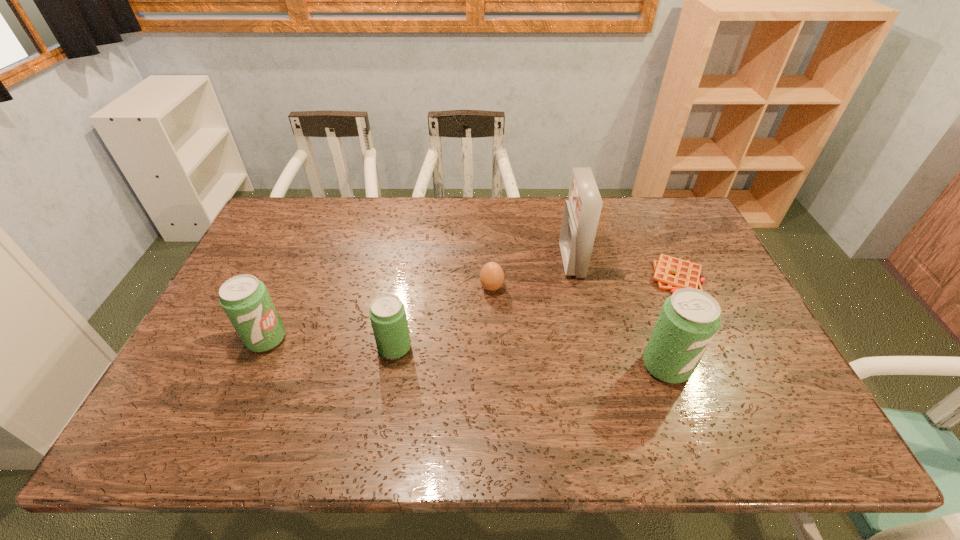
This screenshot has width=960, height=540. What are the coordinates of `the leftmost object` in the screenshot? It's located at (245, 299).

I want to click on the second shortest soda, so click(245, 299).

Locate an element on the screen. Image resolution: width=960 pixels, height=540 pixels. the second object from left to right is located at coordinates (387, 313).

I want to click on the second soda from left to right, so click(x=387, y=313).

The image size is (960, 540). I want to click on the rightmost soda, so click(x=689, y=319).

You are a GUI agent. You are given a task and a screenshot of the screen. Output one action in this format:
    pyautogui.click(x=<x>, y=<y>)
    Task: Click on the third object from right to left
    The width and height of the screenshot is (960, 540).
    Given the screenshot: What is the action you would take?
    pyautogui.click(x=582, y=210)

Where is `the first-aid kit`? This screenshot has height=540, width=960. the first-aid kit is located at coordinates (582, 210).

Identify the location of the shortest object. This screenshot has width=960, height=540. (671, 273).

Image resolution: width=960 pixels, height=540 pixels. In order to click on the fourth object from right to left in this screenshot , I will do `click(491, 276)`.

Where is `the second shortest object`? Image resolution: width=960 pixels, height=540 pixels. the second shortest object is located at coordinates click(491, 276).